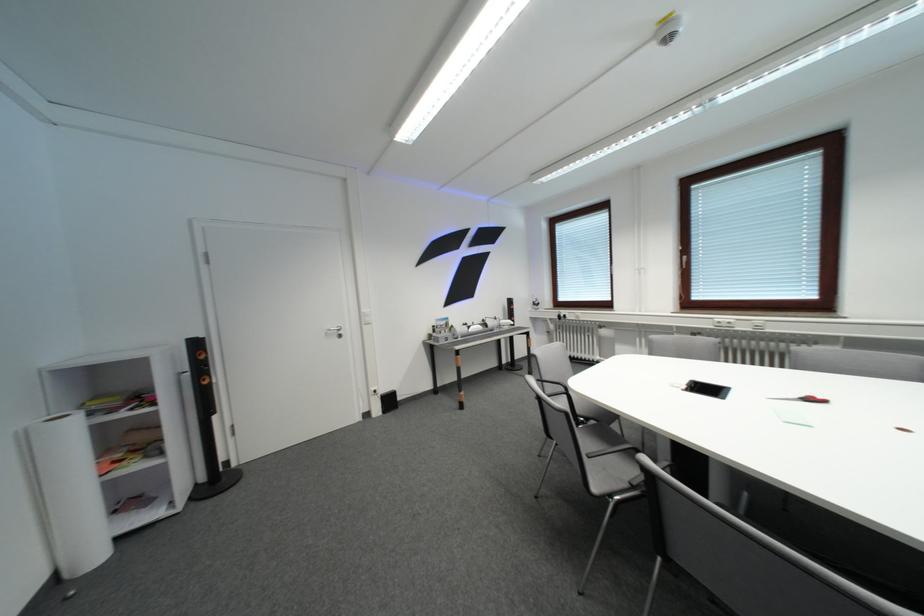
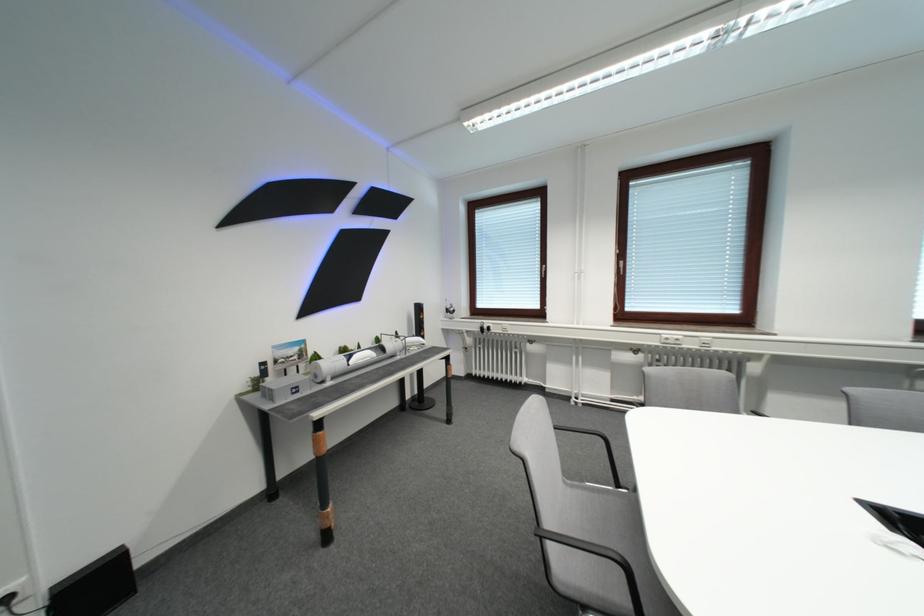
In the second image, find the point that corresponds to [695,260] in the first image.

(631, 265)